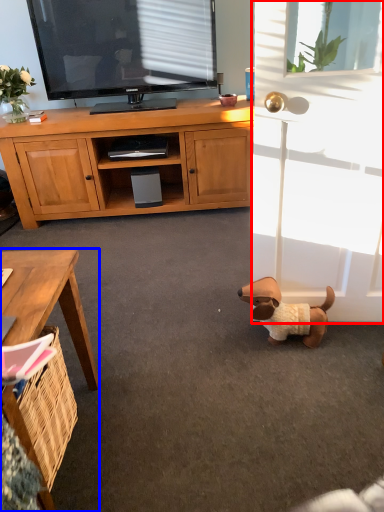
Question: Which object appears closest to the camera in this image, screen door (highlighted by a red box) or desk (highlighted by a blue box)?

Choices:
 (A) screen door
 (B) desk

Answer: (B)